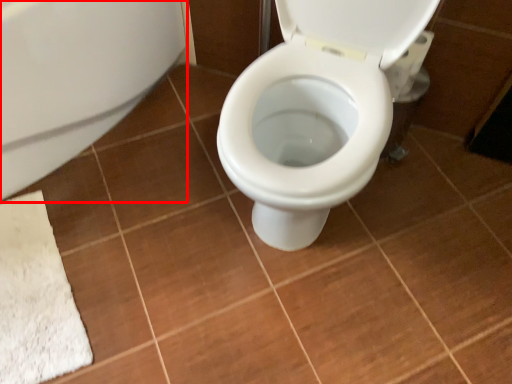
Question: Where is bath (annotated by the red box) located in relation to toilet paper in the image?

Choices:
 (A) right
 (B) left

Answer: (B)